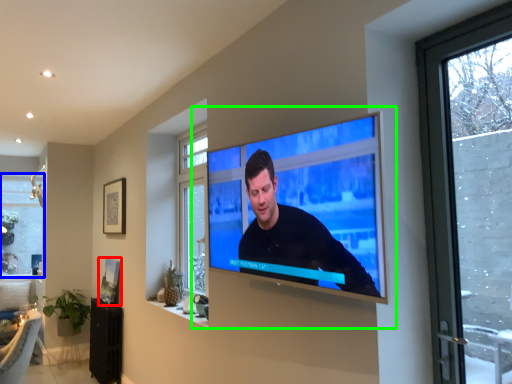
Question: Considering the real-world distances, which object is closest to picture frame (highlighted by a red box)? window (highlighted by a blue box) or tv show (highlighted by a green box).

Choices:
 (A) window
 (B) tv show

Answer: (B)